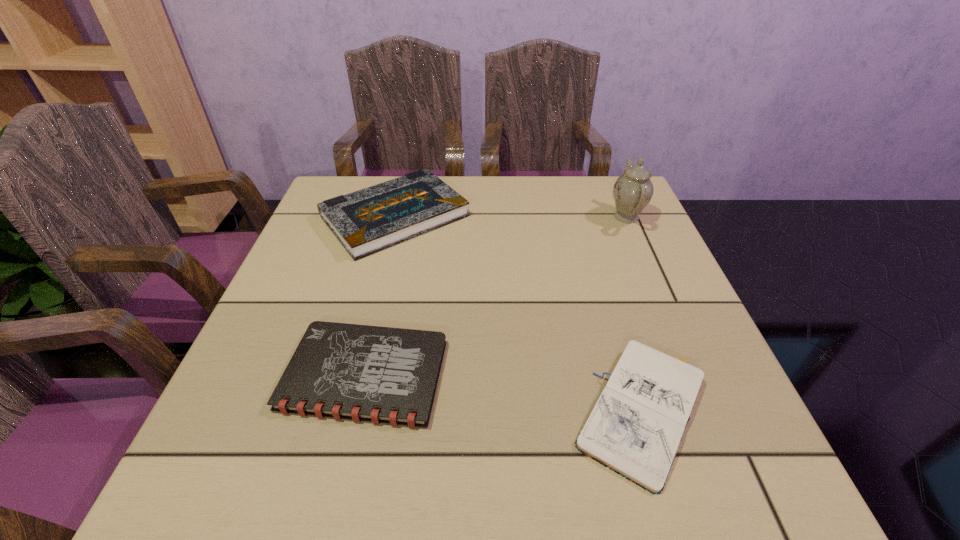
In the image, there is a desktop. At what (x,y) coordinates should I click in order to perform the action: click on vacant space at the right edge. Please return your answer as a coordinate pair (x, y). Looking at the image, I should click on (721, 436).

This screenshot has height=540, width=960. I want to click on vacant area at the near left corner, so click(x=294, y=477).

At what (x,y) coordinates should I click in order to perform the action: click on vacant space at the near right corner of the desktop. Please return your answer as a coordinate pair (x, y). The height and width of the screenshot is (540, 960). Looking at the image, I should click on (697, 459).

Identify the location of unoccupied position between the rightmost notebook and the chinaware. (636, 314).

The width and height of the screenshot is (960, 540). I want to click on vacant area that lies between the rightmost notebook and the tallest notebook, so click(519, 314).

Identify which object is located as the second nearest to the rightmost notebook. Please provide its 2D coordinates. Your answer should be formatted as a tuple, i.e. [(x, y)], where the tuple contains the x and y coordinates of a point satisfying the conditions above.

[(369, 220)]

This screenshot has height=540, width=960. Identify the location of object that is the closest to the tallest notebook. (389, 375).

You are a GUI agent. You are given a task and a screenshot of the screen. Output one action in this format:
    pyautogui.click(x=<x>, y=<y>)
    Task: Click on the notebook object that ranks as the second closest to the tallest notebook
    The image size is (960, 540).
    Given the screenshot: What is the action you would take?
    pyautogui.click(x=635, y=428)

Choose which notebook is the second nearest neighbor to the rightmost notebook. Please provide its 2D coordinates. Your answer should be formatted as a tuple, i.e. [(x, y)], where the tuple contains the x and y coordinates of a point satisfying the conditions above.

[(369, 220)]

The height and width of the screenshot is (540, 960). What are the coordinates of `vacant region that satisfies the following two spatial constraints: 1. on the front side of the rightmost notebook; 2. on the right side of the farthest notebook` in the screenshot? It's located at (346, 412).